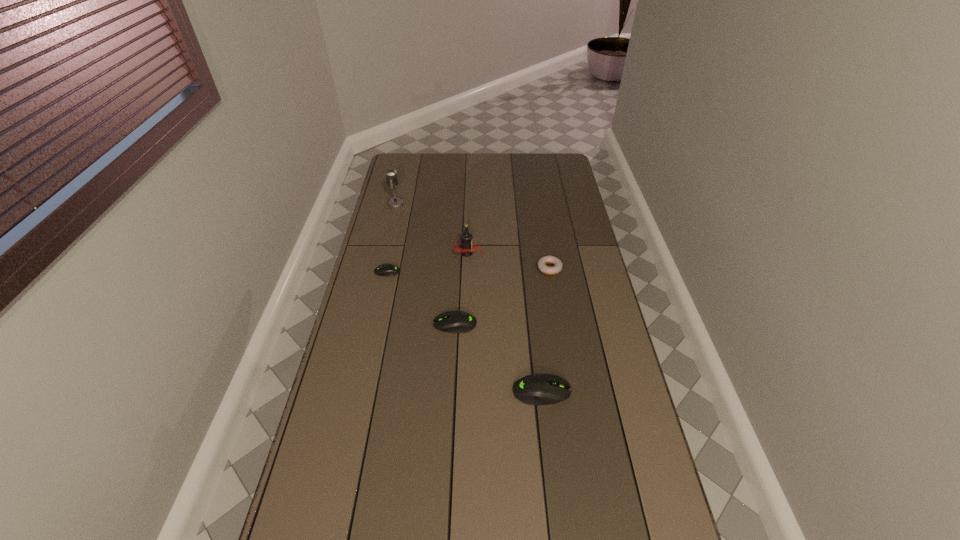
The image size is (960, 540). In order to click on vacant region at the far edge in this screenshot , I will do `click(441, 159)`.

In the image, there is a desktop. Where is `vacant space at the near edge`? The image size is (960, 540). vacant space at the near edge is located at coordinates pyautogui.click(x=461, y=521).

The image size is (960, 540). In the image, there is a desktop. In order to click on vacant space at the left edge in this screenshot , I will do `click(389, 219)`.

Identify the location of free space at the right edge. (604, 346).

This screenshot has width=960, height=540. In order to click on free region at the far right corner in this screenshot , I will do `click(566, 162)`.

Where is `vacant space at the near right corner of the desktop`? The width and height of the screenshot is (960, 540). vacant space at the near right corner of the desktop is located at coordinates (621, 517).

Where is `empty space between the doughnut and the second computer mouse from left to right`? empty space between the doughnut and the second computer mouse from left to right is located at coordinates (502, 296).

This screenshot has height=540, width=960. What are the coordinates of `free area in between the second tallest object and the tallest object` in the screenshot? It's located at (432, 228).

At what (x,y) coordinates should I click in order to perform the action: click on blank region between the shortest computer mouse and the farthest object. Please return your answer as a coordinate pair (x, y). This screenshot has width=960, height=540. Looking at the image, I should click on (392, 238).

This screenshot has width=960, height=540. Identify the location of free spot between the second tallest object and the second nearest object. (461, 289).